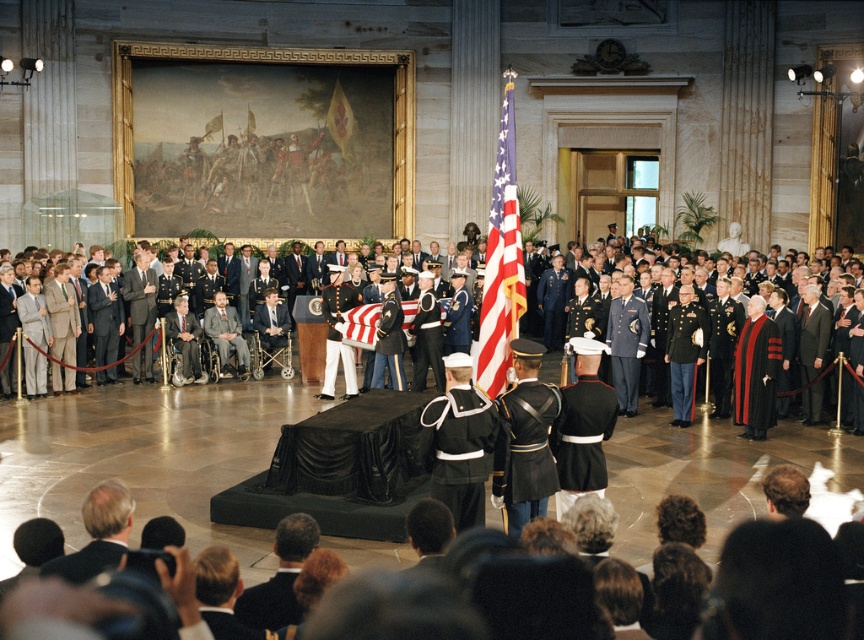
Is american flag at center thinner than dark suit at lower left?

Incorrect, american flag at center's width is not less than dark suit at lower left's.

Is point (515, 314) farther from viewer compared to point (111, 512)?

Yes, point (515, 314) is behind point (111, 512).

At what (x,y) coordinates should I click in order to perform the action: click on american flag at center. Please return your answer as a coordinate pair (x, y). Looking at the image, I should click on (500, 260).

Can you confirm if black glossy uniform at center is positioned to the right of shiny black uniform at center?

In fact, black glossy uniform at center is to the left of shiny black uniform at center.

Find the location of `black glossy uniform at center`. black glossy uniform at center is located at coordinates (461, 448).

Who is higher up, dark suit at lower left or red flag at upper center?

Positioned higher is red flag at upper center.

Is point (68, 577) positioned behind point (335, 116)?

That is False.

Between point (81, 579) and point (342, 131), which one is positioned in front?

Positioned in front is point (81, 579).

This screenshot has width=864, height=640. I want to click on dark suit at lower left, so click(x=97, y=534).